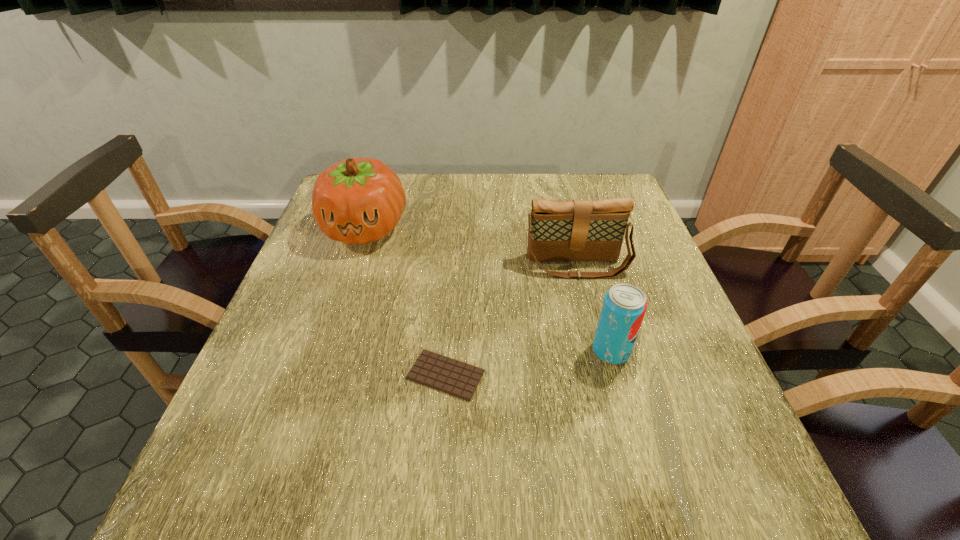
In order to click on object that is at the far edge in this screenshot , I will do `click(358, 200)`.

You are a GUI agent. You are given a task and a screenshot of the screen. Output one action in this format:
    pyautogui.click(x=<x>, y=<y>)
    Task: Click on the object situated at the left edge
    
    Given the screenshot: What is the action you would take?
    pyautogui.click(x=358, y=200)

Locate an element on the screen. The image size is (960, 540). shoulder bag at the right edge is located at coordinates (579, 230).

Identify the location of soda can that is at the right edge. Image resolution: width=960 pixels, height=540 pixels. (624, 306).

What are the coordinates of `object present at the far left corner` in the screenshot? It's located at (358, 200).

Image resolution: width=960 pixels, height=540 pixels. Find the location of `vacant space at the far edge of the desktop`. vacant space at the far edge of the desktop is located at coordinates (509, 195).

At what (x,y) coordinates should I click in order to perform the action: click on free space at the near edge of the desktop. Please return your answer as a coordinate pair (x, y). The image size is (960, 540). Looking at the image, I should click on (530, 485).

At what (x,y) coordinates should I click in order to perform the action: click on free space at the left edge of the desktop. Please return your answer as a coordinate pair (x, y). Looking at the image, I should click on (316, 232).

At what (x,y) coordinates should I click in order to perform the action: click on free space at the right edge of the desktop. Please return your answer as a coordinate pair (x, y). The width and height of the screenshot is (960, 540). Looking at the image, I should click on (647, 368).

Identify the location of free space at the far right corner. (589, 173).